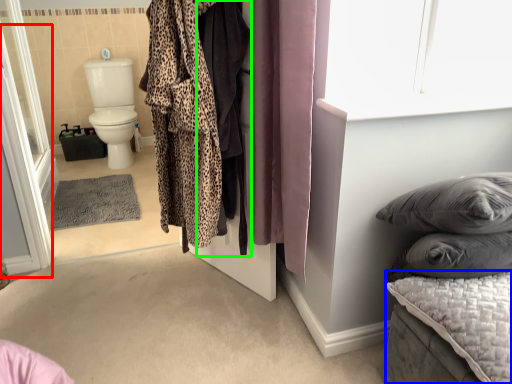
Question: Considering the real-world distances, which object is farthest from screen door (highlighted by a red box)? mattress (highlighted by a blue box) or cloak (highlighted by a green box)?

Choices:
 (A) mattress
 (B) cloak

Answer: (A)